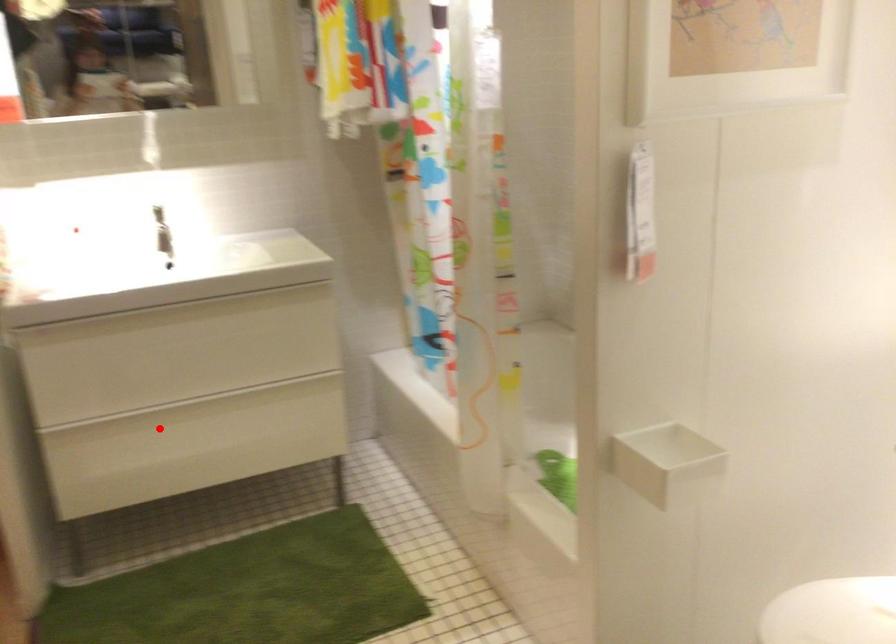
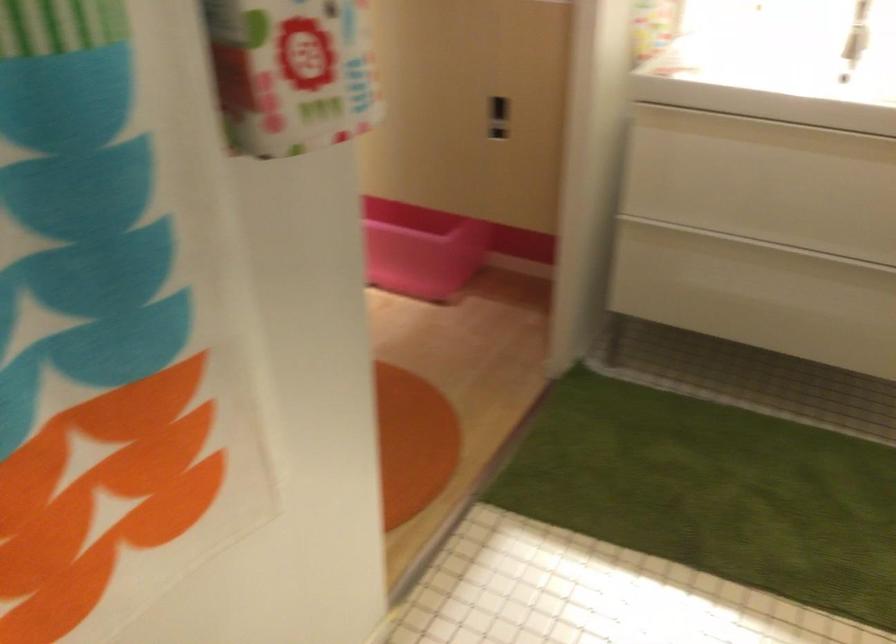
The point at the highlighted location is marked in the first image. Where is the corresponding point in the second image?

(734, 254)